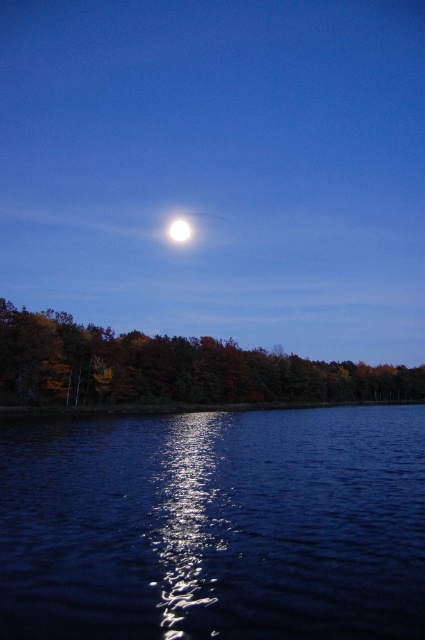
You are standing on the shore looking at the bright white moon at upper center and the glistening dark water at center. If you want to point to the object that is to the right of the other, which one should you point to?

The glistening dark water at center is to the right of the bright white moon at upper center, so you should point to the glistening dark water at center.

You are standing at the center of the image and want to pick up the autumn leaves at lower left. In which direction should you move to reach them?

The autumn leaves at lower left are located at point [172,368], which is to the left and slightly below your current position. Move towards the lower left direction to reach them.